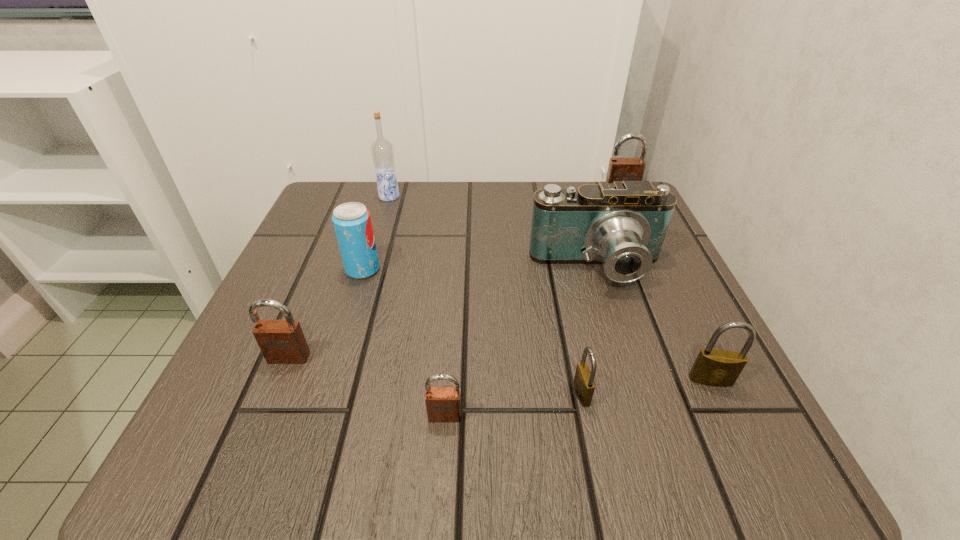
Where is `vacant area at the left edge`? vacant area at the left edge is located at coordinates (324, 348).

Where is `vacant area at the right edge`? The height and width of the screenshot is (540, 960). vacant area at the right edge is located at coordinates (680, 273).

At what (x,y) coordinates should I click in order to perform the action: click on vacant space at the far left corner. Please return your answer as a coordinate pair (x, y). This screenshot has width=960, height=540. Looking at the image, I should click on (348, 183).

This screenshot has height=540, width=960. What are the coordinates of `vacant region at the near left corner of the desktop` in the screenshot? It's located at (283, 442).

The image size is (960, 540). What are the coordinates of `empty space between the soda can and the blue vodka` in the screenshot? It's located at (376, 233).

The width and height of the screenshot is (960, 540). I want to click on vacant area that lies between the leftmost padlock and the farthest brown padlock, so click(x=454, y=276).

The image size is (960, 540). I want to click on free spot between the camcorder and the left brass padlock, so point(589,331).

Image resolution: width=960 pixels, height=540 pixels. Find the location of `free space that is in between the second nearest brown padlock and the blue vodka`. free space that is in between the second nearest brown padlock and the blue vodka is located at coordinates (339, 277).

This screenshot has height=540, width=960. In order to click on vacant area that lies between the bigger brass padlock and the vodka in this screenshot , I will do [x=550, y=288].

At what (x,y) coordinates should I click in order to perform the action: click on unoccupied position between the farthest brown padlock and the right brass padlock. Please return your answer as a coordinate pair (x, y). The height and width of the screenshot is (540, 960). Looking at the image, I should click on (665, 287).